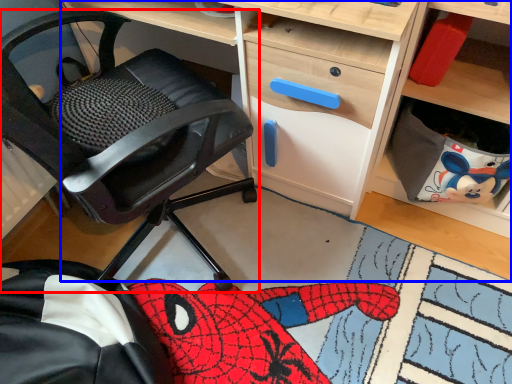
Question: Which of the following is the closest to the observer, chair (highlighted by a red box) or desk (highlighted by a blue box)?

Choices:
 (A) chair
 (B) desk

Answer: (A)